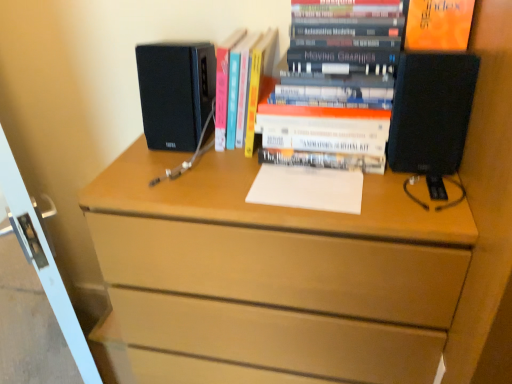
Find the location of a particular element. The height and width of the screenshot is (384, 512). vacant area that is in front of black matte speaker at upper left, which is the second desktop computer in right-to-left order is located at coordinates (173, 167).